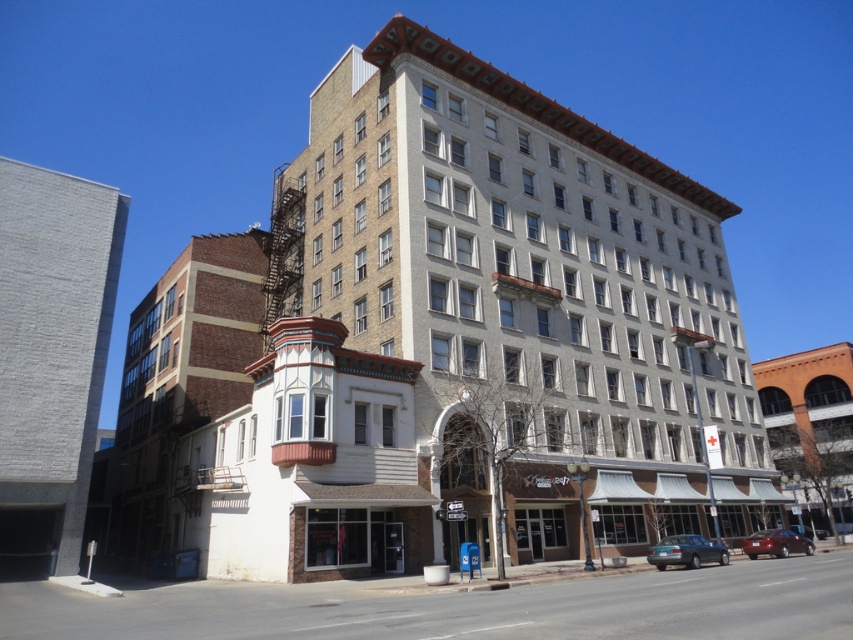
Question: Which of the following is the closest to the observer?

Choices:
 (A) (781, 417)
 (B) (381, 278)

Answer: (B)

Question: Estimate the real-world distances between objects in this image. Which object is closer to the gray brick building at left?

Choices:
 (A) matte black sedan at lower center
 (B) brown brick building at center

Answer: (A)

Question: Which point is closer to the camera?

Choices:
 (A) gray brick building at left
 (B) brown brick building at left

Answer: (A)

Question: Is gray brick building at left wider than brown brick building at left?

Choices:
 (A) yes
 (B) no

Answer: (B)

Question: Is beige stone building at center thinner than matte black sedan at lower center?

Choices:
 (A) no
 (B) yes

Answer: (A)

Question: Is beige stone building at center behind matte black sedan at lower center?

Choices:
 (A) yes
 (B) no

Answer: (B)